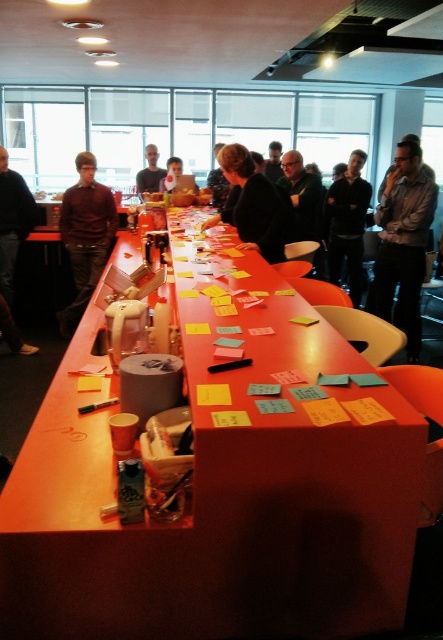
Between point (399, 198) and point (186, 186), which one is positioned in front?

Point (399, 198)

Based on the photo, does matte gray shirt at upper right have a smaller size compared to matte plastic laptop at center?

Correct, matte gray shirt at upper right occupies less space than matte plastic laptop at center.

Between point (380, 209) and point (178, 189), which one is positioned behind?

The point (178, 189) is behind.

You are a GUI agent. You are given a task and a screenshot of the screen. Output one action in this format:
    pyautogui.click(x=<x>, y=<y>)
    Task: Click on the matte gray shirt at upper right
    
    Given the screenshot: What is the action you would take?
    pyautogui.click(x=404, y=241)

Which is more to the left, matte gray shirt at upper right or dark gray sweater at center?

From the viewer's perspective, dark gray sweater at center appears more on the left side.

Between matte gray shirt at upper right and dark gray sweater at center, which one has less height?

With less height is matte gray shirt at upper right.

Is point (370, 291) positioned after point (333, 276)?

No, it is in front of (333, 276).

You are a GUI agent. You are given a task and a screenshot of the screen. Output one action in this format:
    pyautogui.click(x=<x>, y=<y>)
    Task: Click on the matte gray shirt at upper right
    The height and width of the screenshot is (640, 443).
    Given the screenshot: What is the action you would take?
    pyautogui.click(x=404, y=241)

Who is lower down, matte orange table at center or black matte jacket at center?

Positioned lower is matte orange table at center.

Who is positioned more to the left, matte orange table at center or black matte jacket at center?

Positioned to the left is matte orange table at center.

This screenshot has height=640, width=443. What are the coordinates of `matte orange table at center` in the screenshot? It's located at pos(221,490).